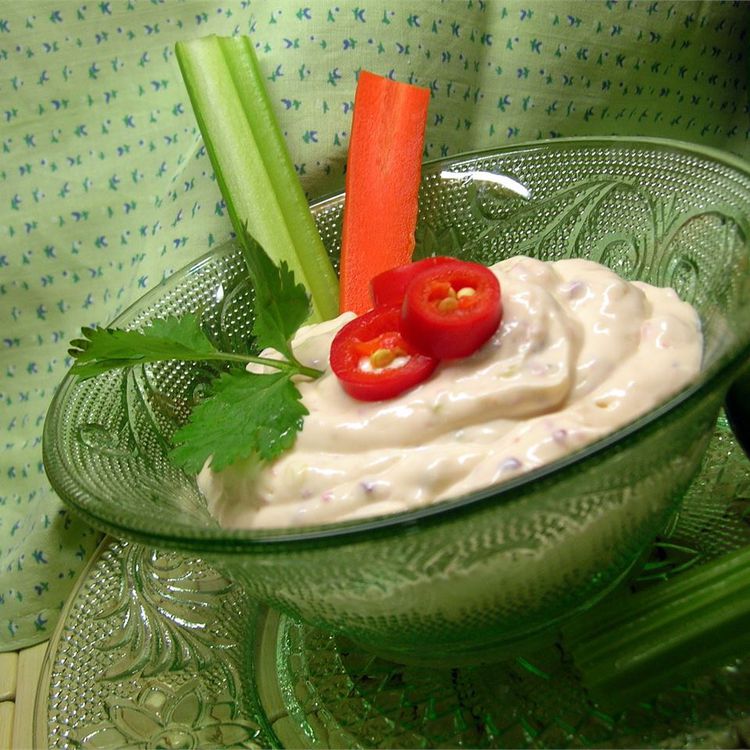
Locate an element on the screen. The height and width of the screenshot is (750, 750). shadowing in corner is located at coordinates (696, 88), (694, 694).